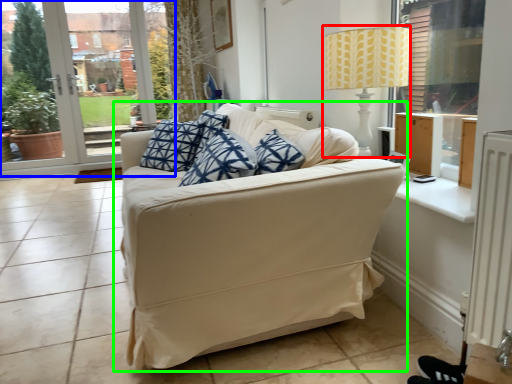
Question: Based on their relative distances, which object is farther from table lamp (highlighted by a red box)? Choose from window frame (highlighted by a blue box) and studio couch (highlighted by a green box).

Choices:
 (A) window frame
 (B) studio couch

Answer: (A)